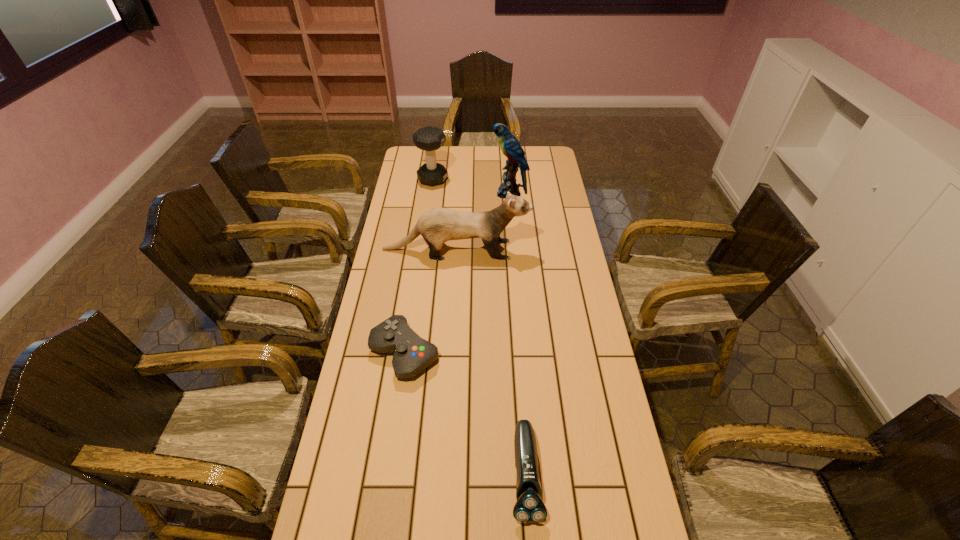
Where is `vacant area between the electric shaver and the control`? vacant area between the electric shaver and the control is located at coordinates (465, 414).

You are a GUI agent. You are given a task and a screenshot of the screen. Output one action in this format:
    pyautogui.click(x=<x>, y=<y>)
    Task: Click on the empty space that is in between the dumbbell and the fourth farthest object
    
    Given the screenshot: What is the action you would take?
    [x=419, y=266]

Identify the location of free space between the electric shaver and the dumbbell. (479, 327).

I want to click on blank region between the dumbbell and the parrot, so click(471, 186).

At what (x,y) coordinates should I click in order to perform the action: click on vacant region between the dumbbell and the fourth farthest object. Please return your answer as a coordinate pair (x, y). This screenshot has height=540, width=960. Looking at the image, I should click on (419, 266).

Locate an element on the screen. This screenshot has height=540, width=960. object that can be found as the third closest to the dumbbell is located at coordinates (412, 354).

Select which object appears as the fourth closest to the nearest object. Please provide its 2D coordinates. Your answer should be formatted as a tuple, i.e. [(x, y)], where the tuple contains the x and y coordinates of a point satisfying the conditions above.

[(429, 138)]